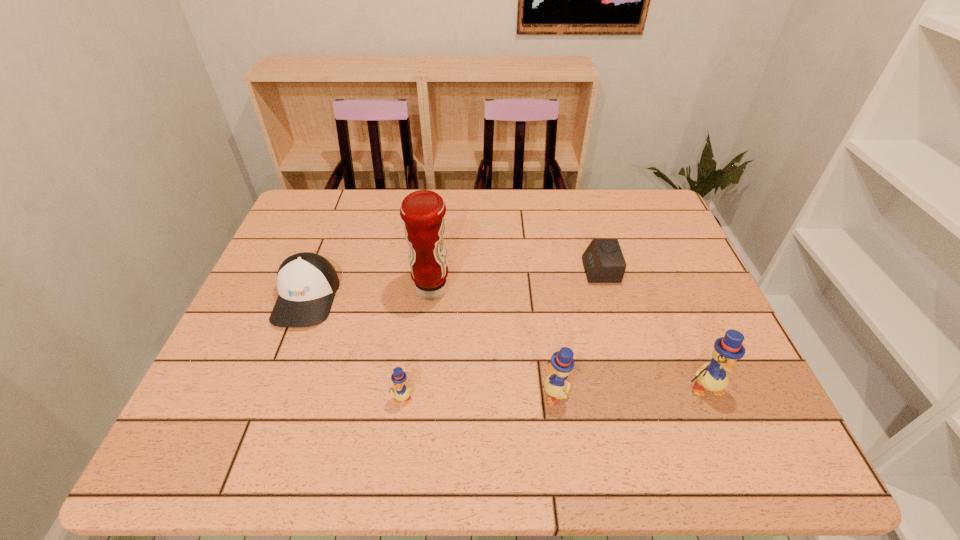
This screenshot has width=960, height=540. Identify the location of vacant space positioned on the face of the second tallest duckling, where the monocle is placed. (495, 393).

Find the location of a particular element. vacant space located 0.290m on the front-facing side of the shortest object is located at coordinates (480, 271).

Where is `vacant space situated on the front-facing side of the shortest object`? The image size is (960, 540). vacant space situated on the front-facing side of the shortest object is located at coordinates (455, 271).

This screenshot has width=960, height=540. Find the location of `vacant space located 0.340m on the front-facing side of the shortest object`. vacant space located 0.340m on the front-facing side of the shortest object is located at coordinates (463, 271).

I want to click on free space located 0.270m on the right of the condiment, so click(x=552, y=290).

Identify the location of vacant region located on the front panel of the cap. (286, 351).

I want to click on object located in the left edge section of the desktop, so click(x=307, y=282).

The image size is (960, 540). I want to click on object at the right edge, so click(x=712, y=376).

The width and height of the screenshot is (960, 540). What are the coordinates of `object situated at the near right corner` in the screenshot? It's located at (712, 376).

At what (x,y) coordinates should I click in order to perform the action: click on vacant area at the far edge. Please return your answer as a coordinate pair (x, y). Looking at the image, I should click on (558, 203).